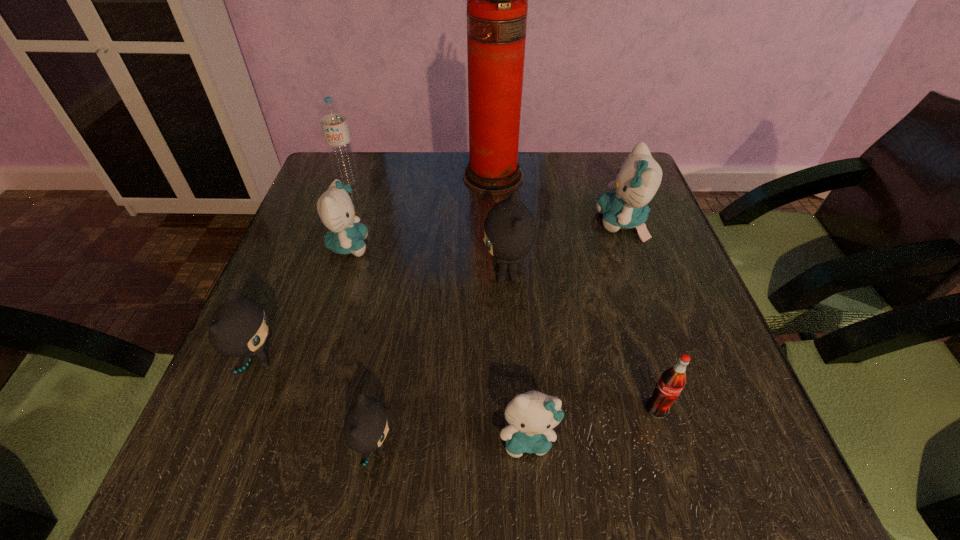
Identify the location of fire extinguisher. The width and height of the screenshot is (960, 540). (497, 0).

Locate an element on the screen. The image size is (960, 540). the eighth shortest object is located at coordinates 332,117.

The height and width of the screenshot is (540, 960). In order to click on the rightmost kitten in this screenshot , I will do `click(639, 177)`.

Find the location of a particular element. The height and width of the screenshot is (540, 960). the biggest blue kitten is located at coordinates (639, 177).

The image size is (960, 540). I want to click on the biggest gray kitten, so click(x=510, y=230).

This screenshot has height=540, width=960. In order to click on the farthest gray kitten in this screenshot , I will do point(510,230).

This screenshot has width=960, height=540. In order to click on the second biggest blue kitten in this screenshot , I will do `click(335, 208)`.

Identify the location of the leftmost blue kitten. (335, 208).

Where is `soda bottle`? The image size is (960, 540). soda bottle is located at coordinates (672, 381).

Locate an element on the screen. the second farthest gray kitten is located at coordinates (238, 328).